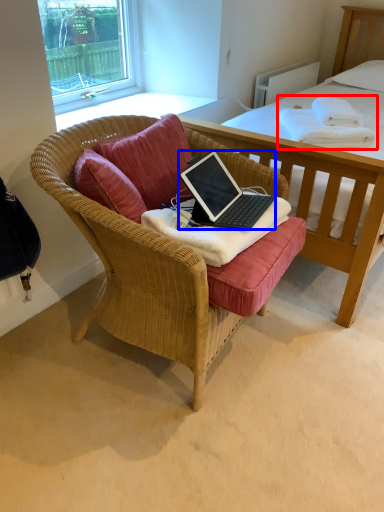
Question: Among these objects, which one is farthest to the camera, blanket (highlighted by a red box) or laptop (highlighted by a blue box)?

Choices:
 (A) blanket
 (B) laptop

Answer: (A)